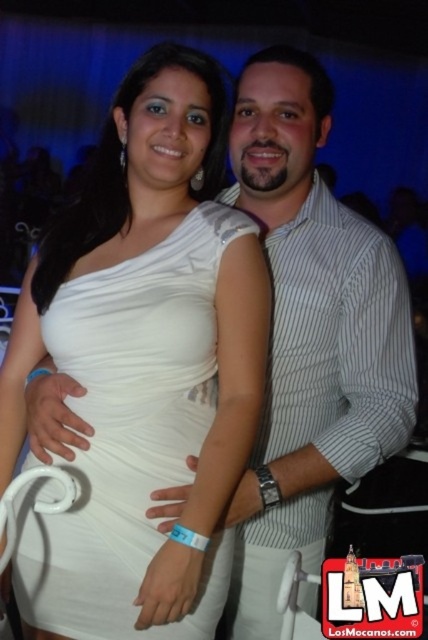
You are at a party and need to pass between the white striped shirt at center and the white satin dress at center. The space between them is narrow. Can you walk through it if you need 10 inches of space?

The white striped shirt at center is 9.70 inches from white satin dress at center. Since the required space is 10 inches, you cannot pass through the gap between them.

Consider the image. You are standing in front of the couple at the party. You notice two points marked on the image. One is at coordinate point [345,227] and the other at point [106,337]. Which point is closer to you?

Point [345,227] is closer to you because it is further to the camera than point [106,337].